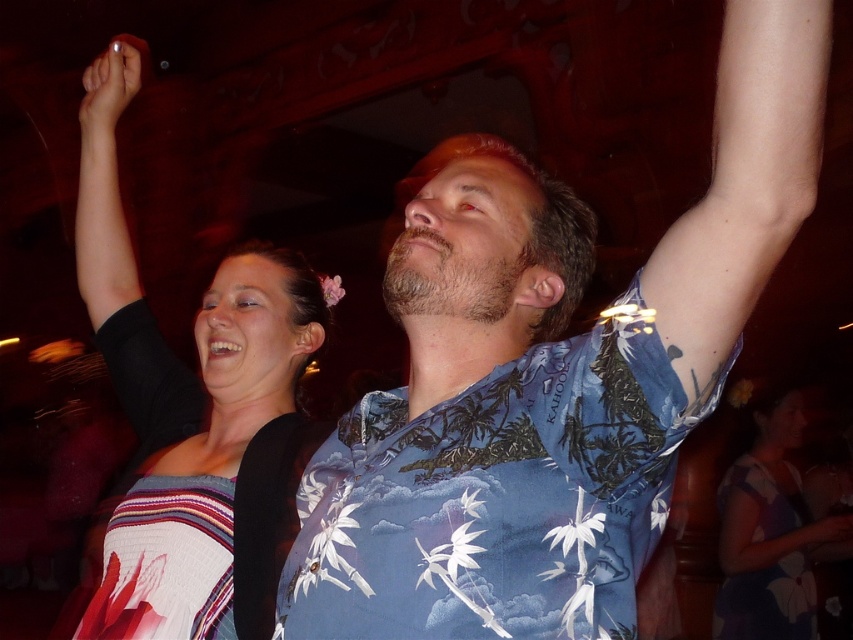
Question: Which is nearer to the striped fabric dress at upper left?

Choices:
 (A) matte black hand at upper left
 (B) matte black hand at upper center
 (C) black fabric arm at upper left

Answer: (C)

Question: Which point appears closest to the camera in this image?

Choices:
 (A) (814, 522)
 (B) (135, 512)
 (C) (740, 483)

Answer: (B)

Question: Does blue floral shirt at upper center lie in front of matte black hand at upper center?

Choices:
 (A) yes
 (B) no

Answer: (A)

Question: Is the position of printed fabric dress at center less distant than that of matte black hand at upper left?

Choices:
 (A) no
 (B) yes

Answer: (A)

Question: Is blue floral shirt at upper center positioned in front of matte black hand at upper left?

Choices:
 (A) yes
 (B) no

Answer: (A)

Question: Which point is closer to the camera?

Choices:
 (A) printed fabric dress at center
 (B) striped fabric dress at upper left
 (C) blue floral shirt at upper center
 (D) matte black hand at upper left

Answer: (C)